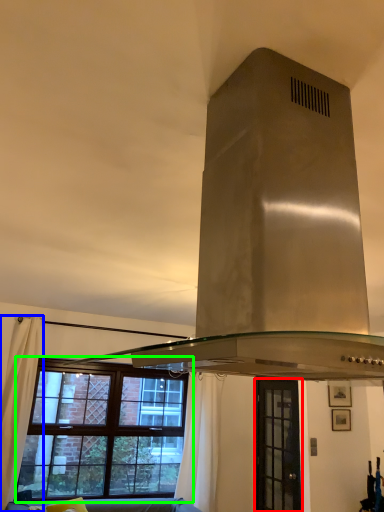
Question: Considering the real-world distances, which object is closest to window (highlighted by a red box)? curtain (highlighted by a blue box) or window (highlighted by a green box).

Choices:
 (A) curtain
 (B) window

Answer: (B)